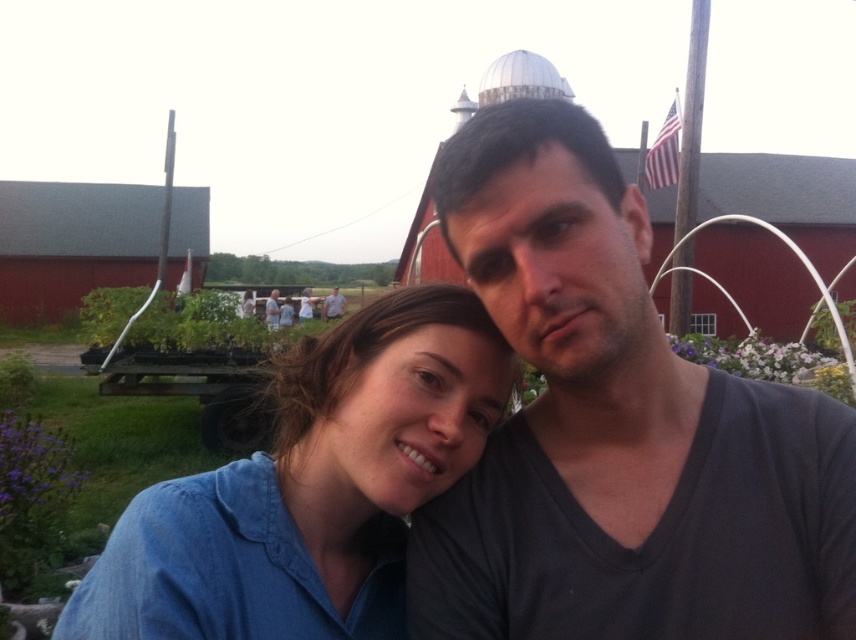
Question: Which point appears closest to the camera in this image?

Choices:
 (A) (270, 321)
 (B) (755, 419)

Answer: (B)

Question: Considering the relative positions of matte gray shirt at center and matte black shirt at center in the image provided, where is matte gray shirt at center located with respect to matte black shirt at center?

Choices:
 (A) below
 (B) above

Answer: (B)

Question: Can you confirm if dark gray v-neck shirt at center is bigger than matte black shirt at center?

Choices:
 (A) yes
 (B) no

Answer: (B)

Question: Which is nearer to the blue denim shirt at center?

Choices:
 (A) dark gray v-neck shirt at center
 (B) matte gray shirt at center

Answer: (A)

Question: Is dark gray v-neck shirt at center smaller than blue denim shirt at center?

Choices:
 (A) yes
 (B) no

Answer: (A)

Question: Which point appears closest to the camera in this image?

Choices:
 (A) (559, 225)
 (B) (265, 301)
 (C) (200, 568)
 (D) (337, 298)

Answer: (A)